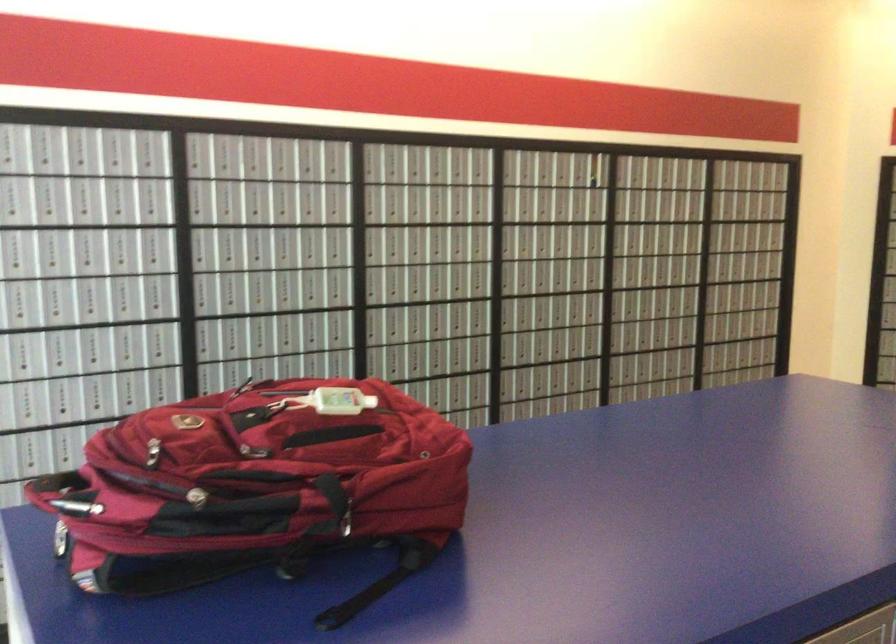
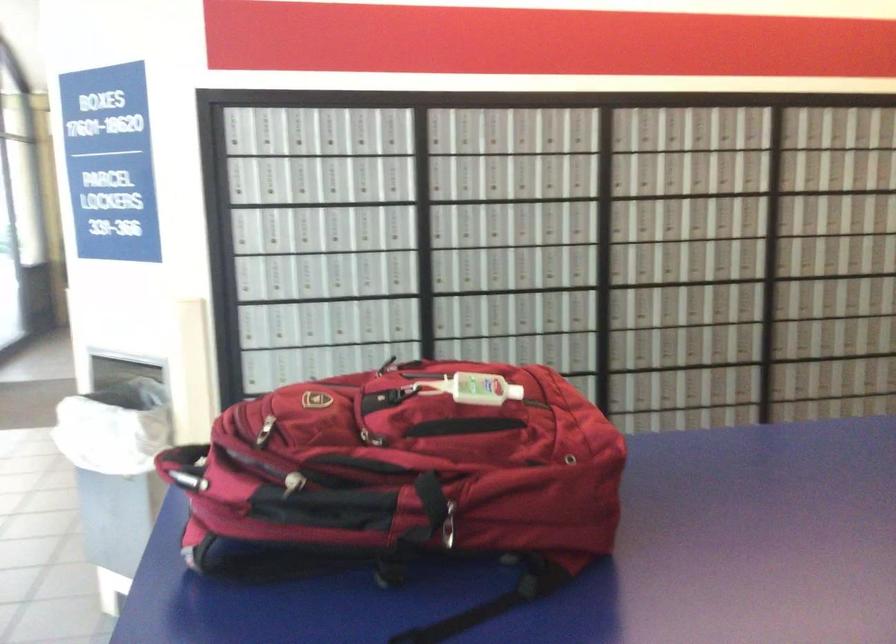
Locate, in the second image, the point that corresponds to point (211, 495) in the first image.

(293, 483)